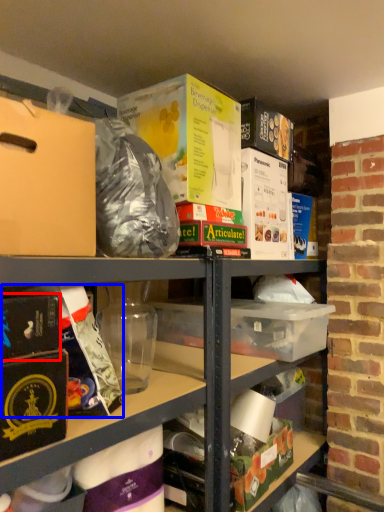
Question: Which of the following is the farthest to the observer, paperback book (highlighted by a red box) or wrapping paper (highlighted by a blue box)?

Choices:
 (A) paperback book
 (B) wrapping paper

Answer: (B)